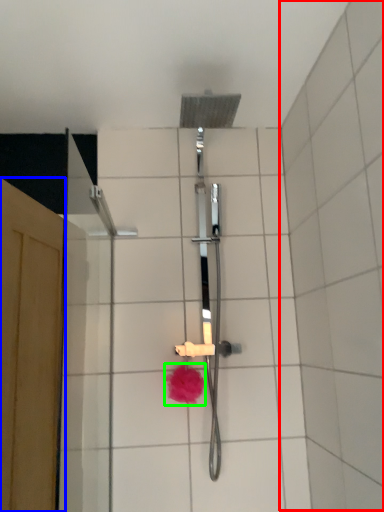
Question: Considering the real-world distances, which object is closest to ceramic tile (highlighted by a red box)? screen door (highlighted by a blue box) or flower (highlighted by a green box).

Choices:
 (A) screen door
 (B) flower

Answer: (B)